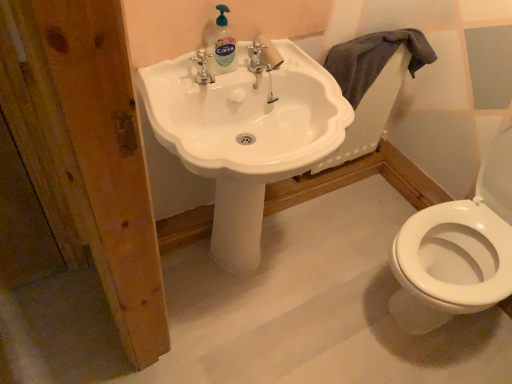
This screenshot has height=384, width=512. Identify the location of free space in front of clear plastic bottle at upper center. (195, 90).